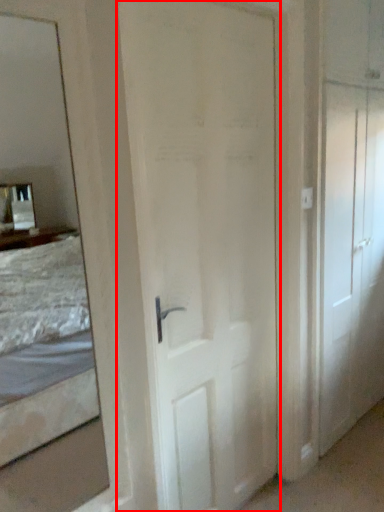
Question: From the image's perspective, where is door (annotated by the red box) located in relation to door in the image?

Choices:
 (A) above
 (B) below

Answer: (B)